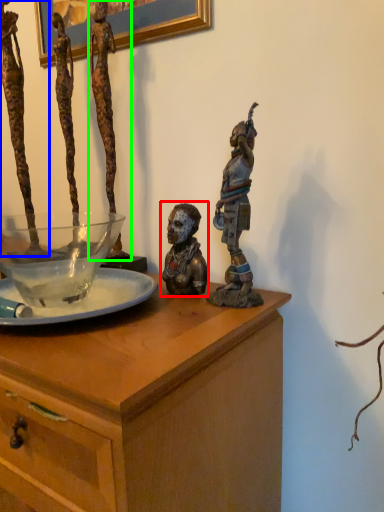
Question: Based on their relative distances, which object is nearer to person (highlighted by a red box)? Choose from person (highlighted by a blue box) and person (highlighted by a green box).

Choices:
 (A) person
 (B) person

Answer: (B)